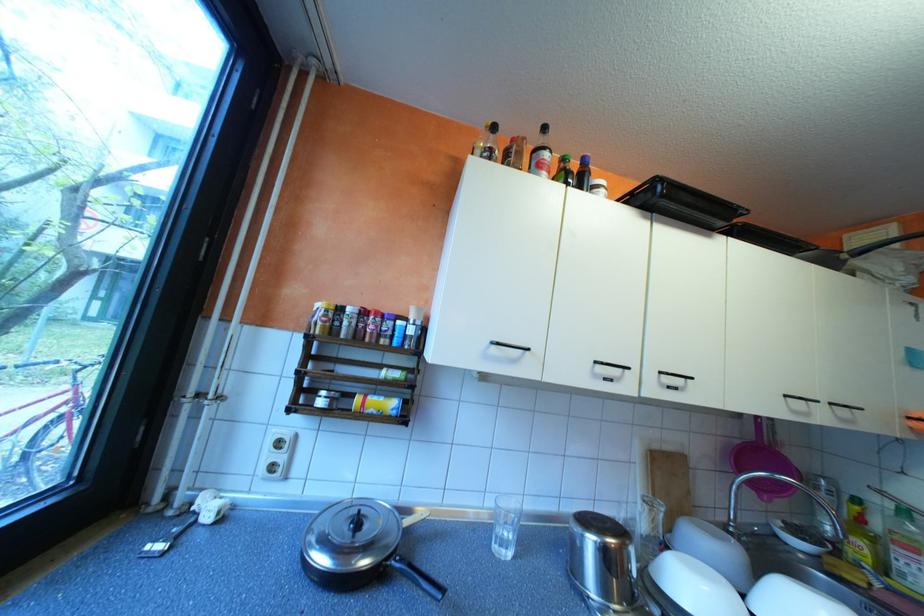
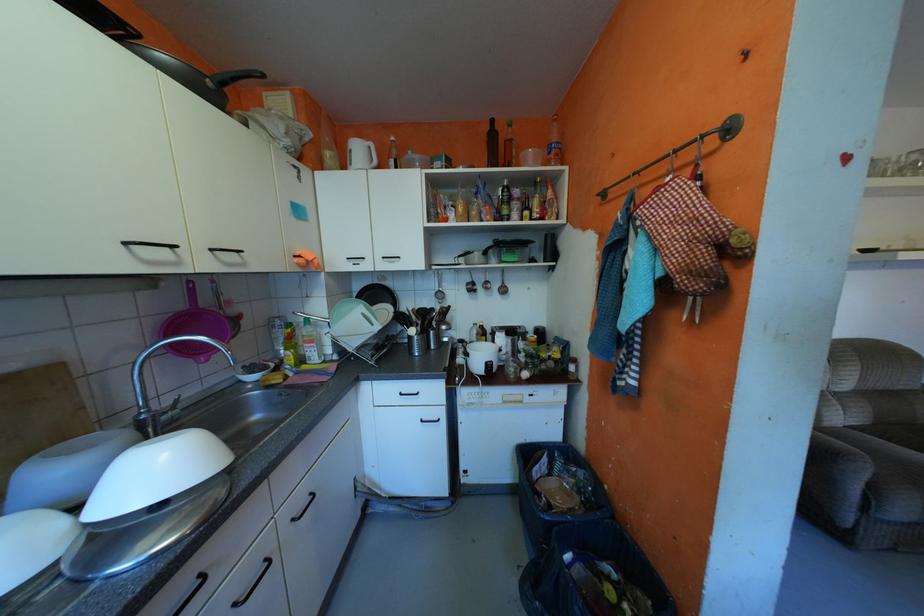
The first image is from the beginning of the video and the second image is from the end. How did the camera likely rotate when shooting the video?

The camera rotated toward right-down.